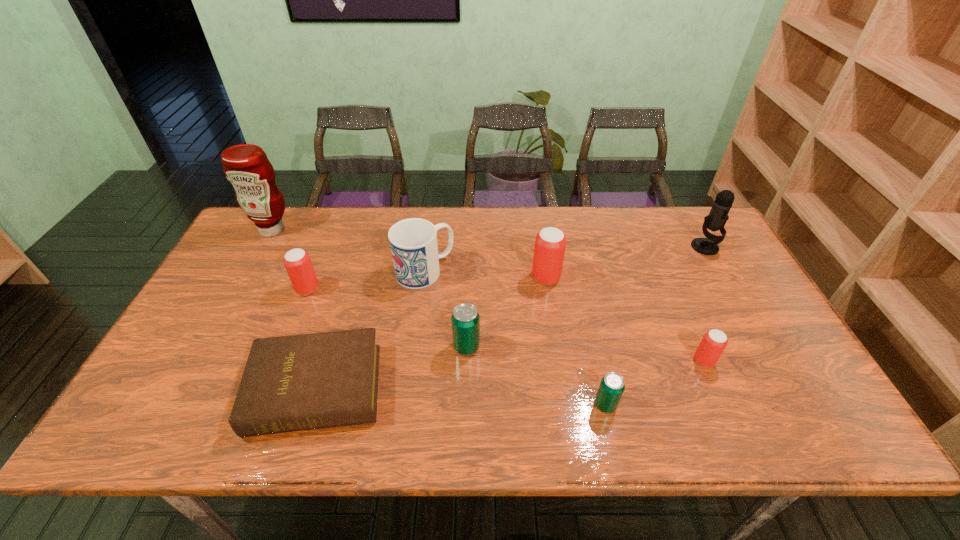
What are the coordinates of `the tallest object` in the screenshot? It's located at (246, 166).

Identify the location of the leftmost object. Image resolution: width=960 pixels, height=540 pixels. pyautogui.click(x=246, y=166).

This screenshot has height=540, width=960. Identify the location of microphone. (718, 216).

At what (x,y) coordinates should I click in order to perform the action: click on the rightmost object. Please return your answer as a coordinate pair (x, y). The height and width of the screenshot is (540, 960). Looking at the image, I should click on (718, 216).

Locate an element on the screen. Image resolution: width=960 pixels, height=540 pixels. the tallest beer can is located at coordinates (550, 243).

Where is `the second red beer can from left to right`? Image resolution: width=960 pixels, height=540 pixels. the second red beer can from left to right is located at coordinates (550, 243).

Identify the location of blue mug. (413, 242).

The image size is (960, 540). Find the location of `the second biggest red beer can`. the second biggest red beer can is located at coordinates click(297, 262).

You are a GUI agent. You are given a task and a screenshot of the screen. Output one action in this format:
    pyautogui.click(x=<x>, y=<y>)
    Task: Click on the leftmost beer can
    The width and height of the screenshot is (960, 540).
    Given the screenshot: What is the action you would take?
    pyautogui.click(x=297, y=262)

Where is `the bigger teal beer can`? The height and width of the screenshot is (540, 960). the bigger teal beer can is located at coordinates (465, 319).